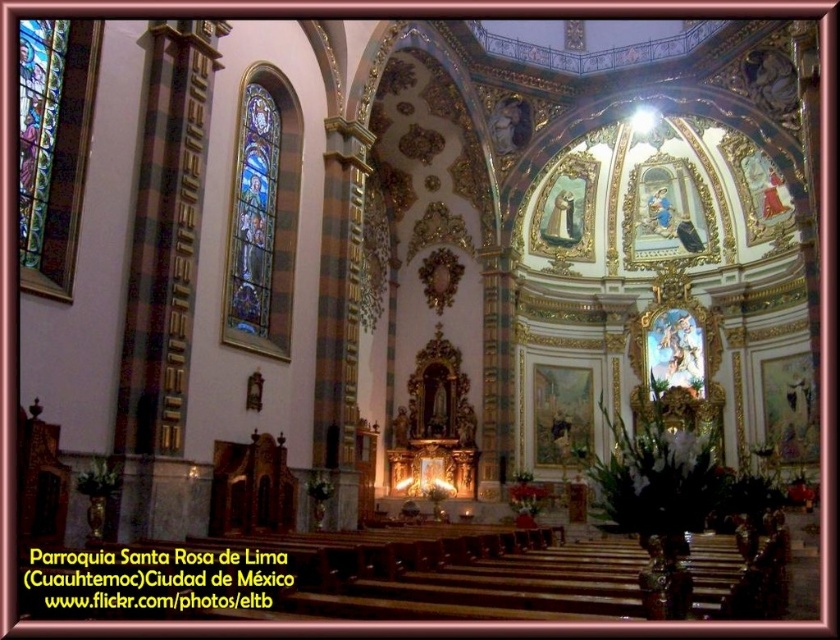
You are an art student visiting Parroquia Santa Rosa de Lima and notice two stained glass artworks on the left side of the altar area. One is labeled as stained glass at left and the other as stained glass window at left. Your professor asks which one is bigger. How do you respond?

The stained glass at left is larger in size than the stained glass window at left, so the stained glass at left is bigger.

You are an interior designer planning to install a new light fixture between the stained glass at left and the stained glass window at left. Which stained glass has a larger width to accommodate the fixture?

The stained glass at left has a larger width than the stained glass window at left, so it can accommodate the new light fixture better.